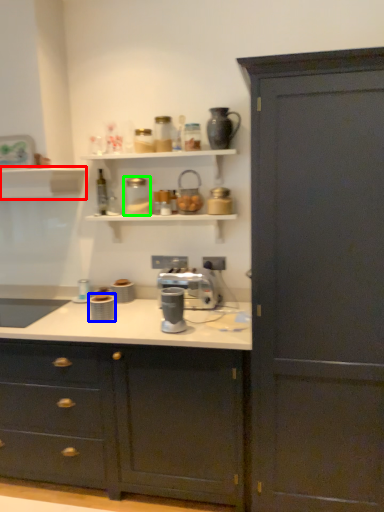
Question: Which object is positioned farthest from shelf (highlighted by a red box)? Select from appliance (highlighted by a blue box) and appliance (highlighted by a green box).

Choices:
 (A) appliance
 (B) appliance

Answer: (A)